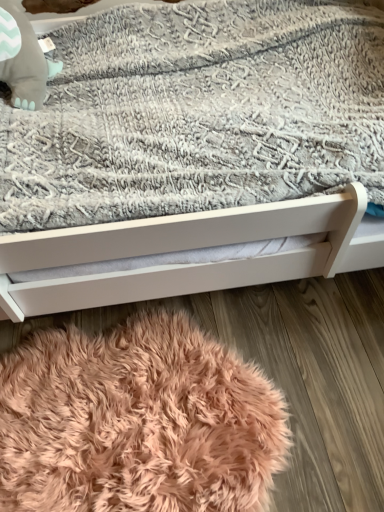
At what (x,y) coordinates should I click in order to perform the action: click on peachy soft rug at lower center. Please return your answer as a coordinate pair (x, y). This screenshot has height=512, width=384. Looking at the image, I should click on coord(137,421).

What do you see at coordinates (137, 421) in the screenshot?
I see `peachy soft rug at lower center` at bounding box center [137, 421].

You are a GUI agent. You are given a task and a screenshot of the screen. Output one action in this format:
    pyautogui.click(x=<x>, y=<y>)
    Task: Click on the white matte bed at center
    The width and height of the screenshot is (384, 512).
    Given the screenshot: What is the action you would take?
    click(x=195, y=156)

I want to click on peachy soft rug at lower center, so click(137, 421).

Considering their positions, is matte gray plush baby elephant at upper left located in front of or behind peachy soft rug at lower center?

matte gray plush baby elephant at upper left is positioned farther from the viewer than peachy soft rug at lower center.

Based on the photo, is matte gray plush baby elephant at upper left in contact with peachy soft rug at lower center?

matte gray plush baby elephant at upper left is not next to peachy soft rug at lower center, and they're not touching.

Who is shorter, matte gray plush baby elephant at upper left or peachy soft rug at lower center?

peachy soft rug at lower center.

At what (x,y) coordinates should I click in order to perform the action: click on baby elephant that is above the peachy soft rug at lower center (from a real-world perspective). Please return your answer as a coordinate pair (x, y). This screenshot has width=384, height=512. Looking at the image, I should click on (23, 59).

Which object is more forward, matte gray plush baby elephant at upper left or white matte bed at center?

Positioned in front is white matte bed at center.

Between point (44, 84) and point (362, 208), which one is positioned behind?

The point (44, 84) is behind.

Is point (90, 468) closer or farther from the camera than point (39, 49)?

Point (90, 468) is closer to the camera than point (39, 49).

Identify the location of baby elephant behind the peachy soft rug at lower center. (23, 59).

Is peachy soft rug at lower center touching matte gray plush baby elephant at upper left?

peachy soft rug at lower center is not next to matte gray plush baby elephant at upper left, and they're not touching.

Which is in front, peachy soft rug at lower center or matte gray plush baby elephant at upper left?

peachy soft rug at lower center is closer to the camera.

Which point is more distant from viewer, [194,10] or [9,25]?

Point [194,10]

Can you confirm if white matte bed at center is wider than matte gray plush baby elephant at upper left?

Yes.

Measure the distance from white matte bed at center to matte gray plush baby elephant at upper left.

18.90 inches.

Would you say matte gray plush baby elephant at upper left is part of white matte bed at center's contents?

That's correct, matte gray plush baby elephant at upper left is inside white matte bed at center.

Measure the distance between white matte bed at center and peachy soft rug at lower center.

white matte bed at center and peachy soft rug at lower center are 18.50 inches apart from each other.

Can you confirm if white matte bed at center is thinner than peachy soft rug at lower center?

No.

Can you tell me how much white matte bed at center and peachy soft rug at lower center differ in facing direction?

white matte bed at center and peachy soft rug at lower center are facing 90 degrees away from each other.

Which of these two, white matte bed at center or peachy soft rug at lower center, is bigger?

white matte bed at center.

Can you confirm if peachy soft rug at lower center is smaller than white matte bed at center?

Yes, peachy soft rug at lower center is smaller than white matte bed at center.

From the image's perspective, is peachy soft rug at lower center located above white matte bed at center?

Incorrect, from the image's perspective, peachy soft rug at lower center is lower than white matte bed at center.

Does peachy soft rug at lower center turn towards white matte bed at center?

No, peachy soft rug at lower center does not turn towards white matte bed at center.

Considering the positions of objects peachy soft rug at lower center and white matte bed at center in the image provided, who is more to the left, peachy soft rug at lower center or white matte bed at center?

Positioned to the left is peachy soft rug at lower center.

Where is `baby elephant located on the left of peachy soft rug at lower center`? baby elephant located on the left of peachy soft rug at lower center is located at coordinates (23, 59).

Find the location of a particular element. The height and width of the screenshot is (512, 384). baby elephant that appears above the white matte bed at center (from the image's perspective) is located at coordinates (23, 59).

Considering their positions, is white matte bed at center positioned further to matte gray plush baby elephant at upper left than peachy soft rug at lower center?

peachy soft rug at lower center is positioned further to the anchor matte gray plush baby elephant at upper left.

Which object lies further to the anchor point white matte bed at center, peachy soft rug at lower center or matte gray plush baby elephant at upper left?

The object further to white matte bed at center is matte gray plush baby elephant at upper left.

From the image, which object appears to be farther from peachy soft rug at lower center, white matte bed at center or matte gray plush baby elephant at upper left?

matte gray plush baby elephant at upper left.

Looking at the image, which one is located further to peachy soft rug at lower center, matte gray plush baby elephant at upper left or white matte bed at center?

matte gray plush baby elephant at upper left lies further to peachy soft rug at lower center than the other object.

Considering their positions, is peachy soft rug at lower center positioned closer to matte gray plush baby elephant at upper left than white matte bed at center?

white matte bed at center is closer to matte gray plush baby elephant at upper left.

Estimate the real-world distances between objects in this image. Which object is closer to white matte bed at center, matte gray plush baby elephant at upper left or peachy soft rug at lower center?

The object closer to white matte bed at center is peachy soft rug at lower center.

The height and width of the screenshot is (512, 384). Identify the location of bed between matte gray plush baby elephant at upper left and peachy soft rug at lower center in the vertical direction. (195, 156).